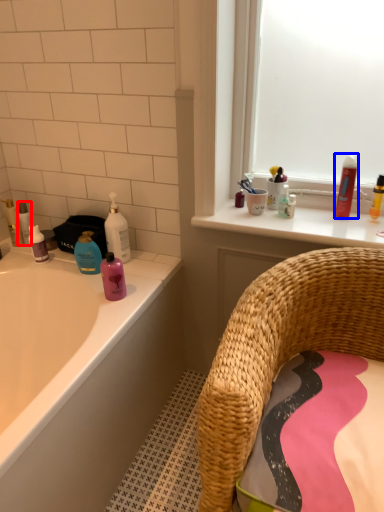
Question: Which object is closer to the camera taking this photo, toiletry (highlighted by a red box) or mouthwash (highlighted by a blue box)?

Choices:
 (A) toiletry
 (B) mouthwash

Answer: (B)